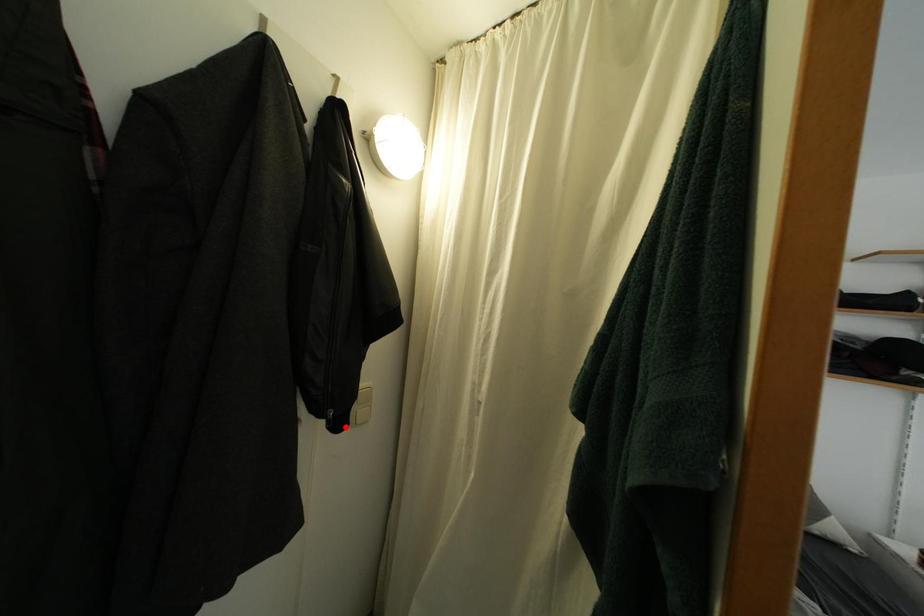
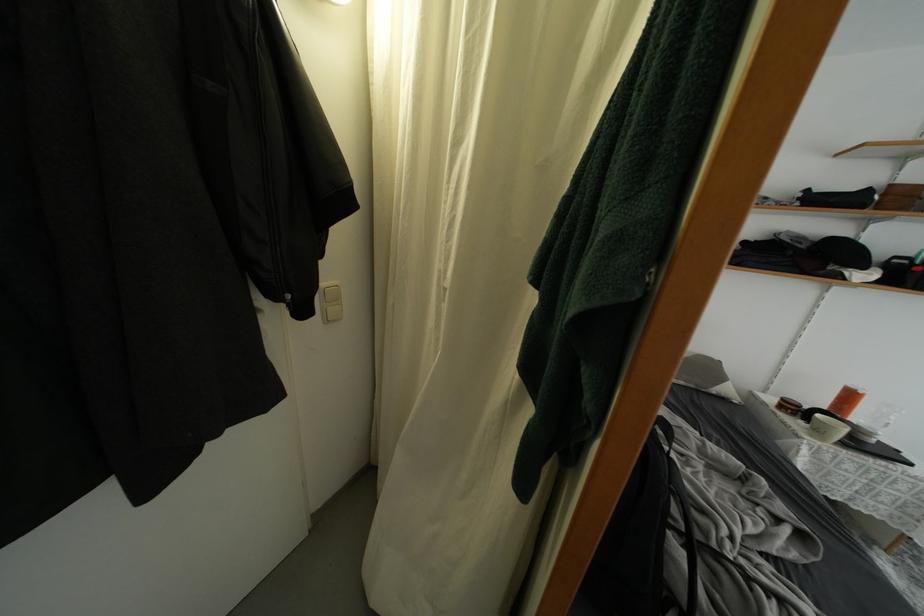
Locate, in the second image, the point that corresponds to the highlighted location in the first image.

(310, 315)